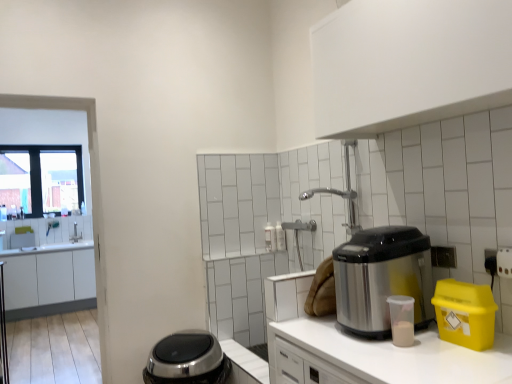
Find the location of a particular element. The image size is (512, 384). free location in front of stainless steel appliance at right is located at coordinates (388, 353).